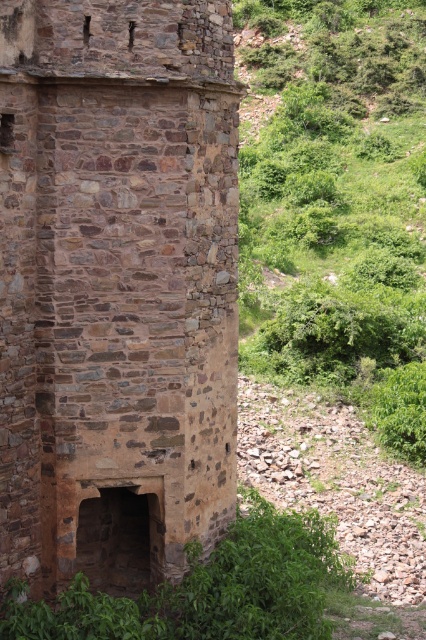
You are standing in front of the stone structure and want to take a photo of the brown stone tower at left and the green leafy vegetation at lower center. Which object should you focus on first to ensure both are in the frame?

The green leafy vegetation at lower center is behind the brown stone tower at left, so you should focus on the brown stone tower at left first to ensure both are in the frame.